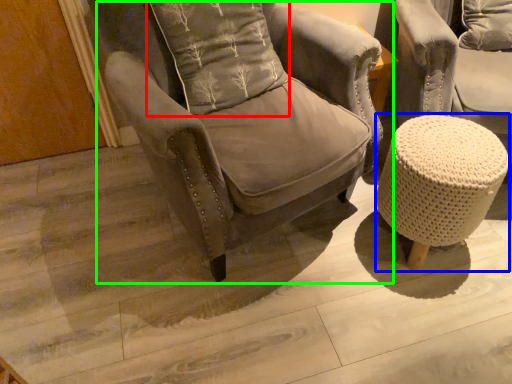
Question: Which object is the farthest from pillow (highlighted by a red box)? Choose among these: bar stool (highlighted by a blue box) or chair (highlighted by a green box).

Choices:
 (A) bar stool
 (B) chair

Answer: (A)